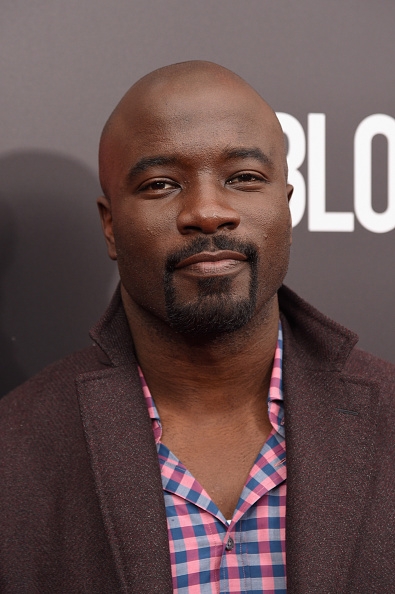
You are a GUI agent. You are given a task and a screenshot of the screen. Output one action in this format:
    pyautogui.click(x=<x>, y=<y>)
    Task: Click on the coat
    Image resolution: width=395 pixels, height=594 pixels.
    Given the screenshot: What is the action you would take?
    click(61, 413)